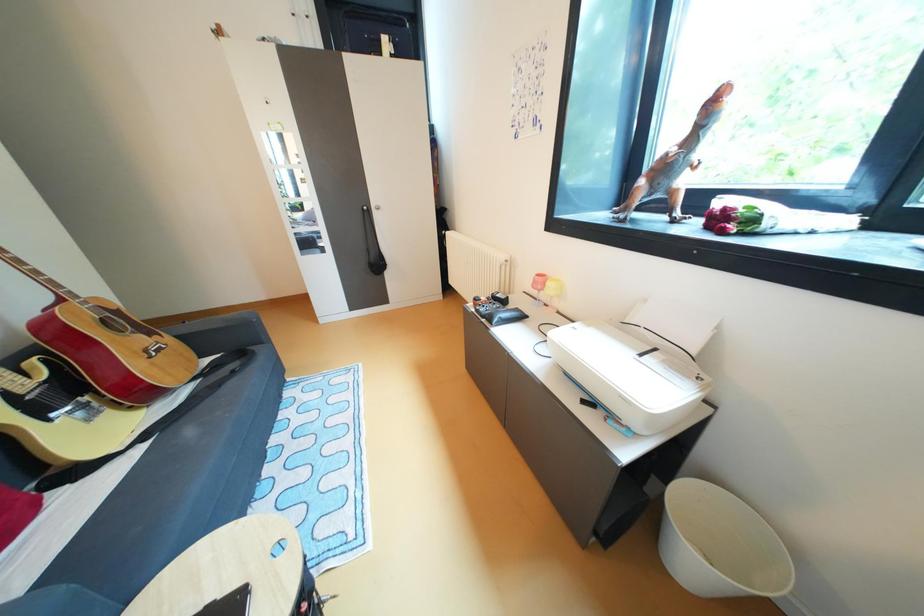
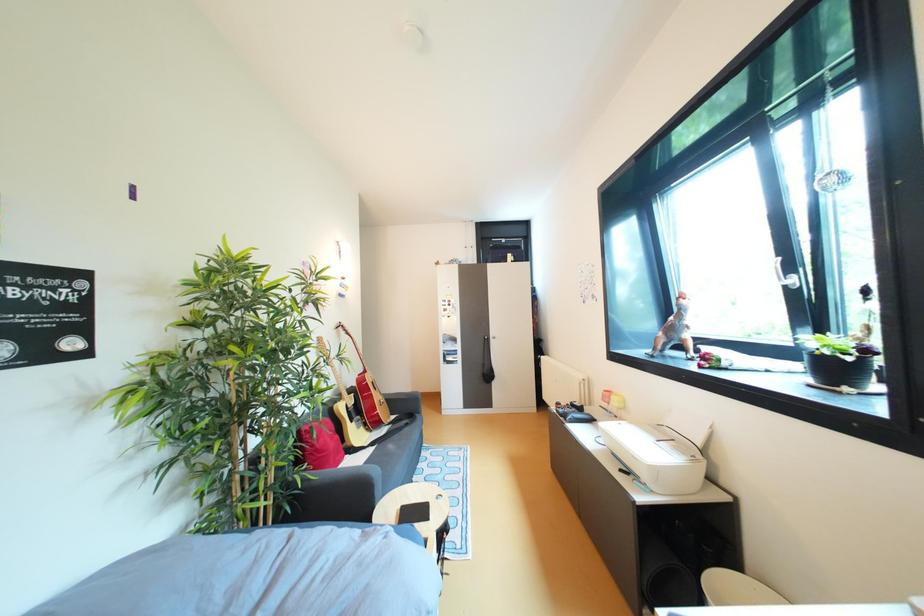
How did the camera likely rotate?

The rotation direction of the camera is left-up.